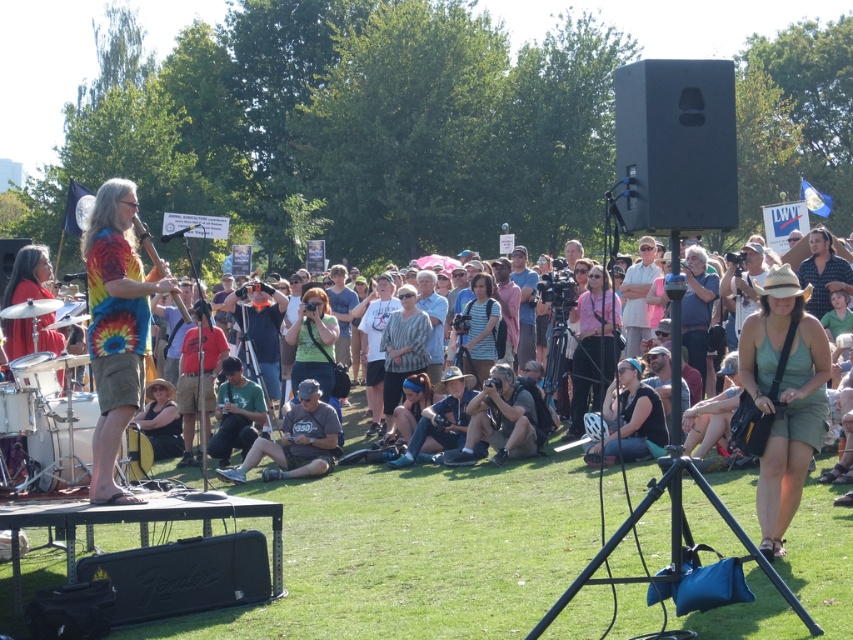
Is tie-dye fabric shirt at left shorter than gray cotton shirt at center?

Yes, tie-dye fabric shirt at left is shorter than gray cotton shirt at center.

Who is positioned more to the left, tie-dye fabric shirt at left or gray cotton shirt at center?

tie-dye fabric shirt at left

In order to click on tie-dye fabric shirt at left in this screenshot , I will do `click(115, 326)`.

This screenshot has height=640, width=853. I want to click on green fabric dress at center, so click(x=784, y=397).

Who is more distant from viewer, (x=808, y=285) or (x=299, y=429)?

Positioned behind is point (x=299, y=429).

This screenshot has width=853, height=640. In order to click on green fabric dress at center in this screenshot , I will do `click(784, 397)`.

Does point (625, 368) come closer to viewer compared to point (268, 477)?

Yes, it is.

The height and width of the screenshot is (640, 853). Find the location of `black fabric at center`. black fabric at center is located at coordinates (627, 419).

You are a GUI agent. You are given a task and a screenshot of the screen. Output one action in this format:
    pyautogui.click(x=<x>, y=<y>)
    Task: Click on the black fabric at center
    
    Given the screenshot: What is the action you would take?
    pyautogui.click(x=627, y=419)